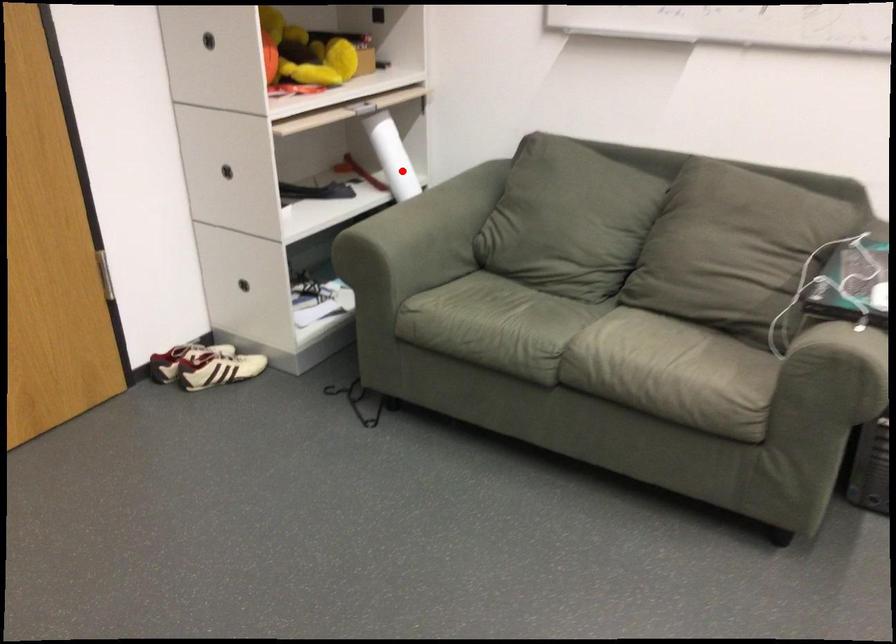
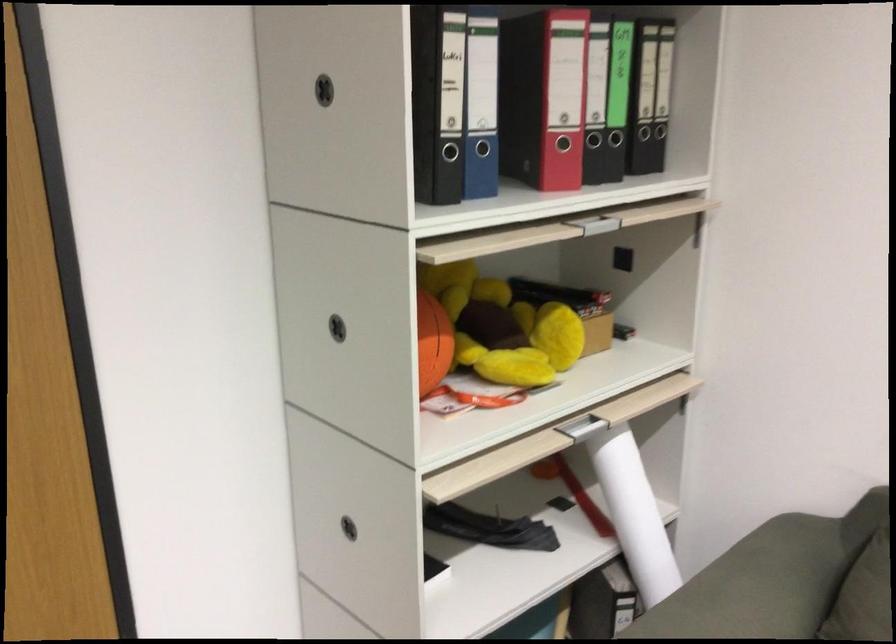
Question: I am providing you with two images of the same scene from different viewpoints. A red point is shown in image1. For the corresponding object point in image2, is it positioned nearer or farther from the camera?

Choices:
 (A) Nearer
 (B) Farther

Answer: (A)